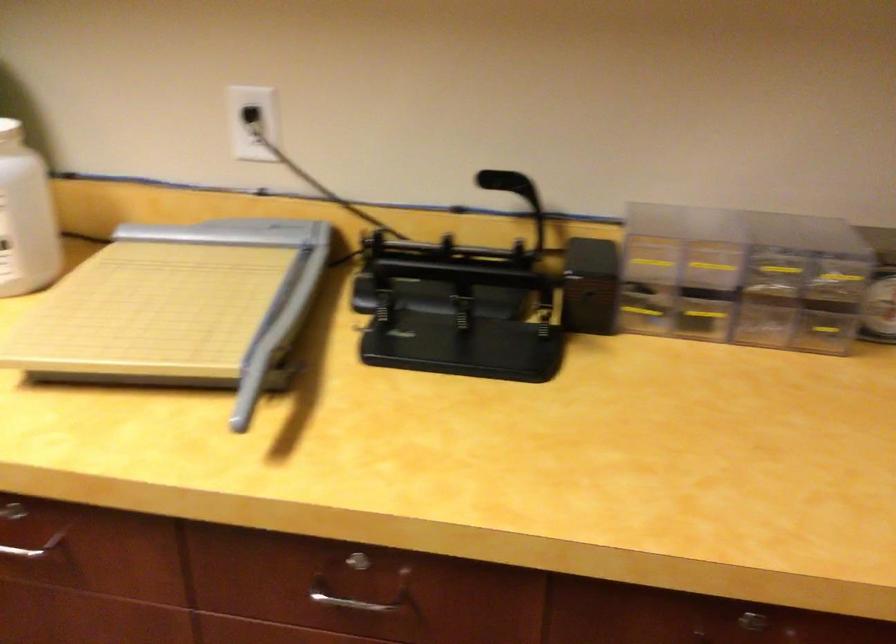
Where is `paper cutter handle`? The image size is (896, 644). paper cutter handle is located at coordinates (277, 301).